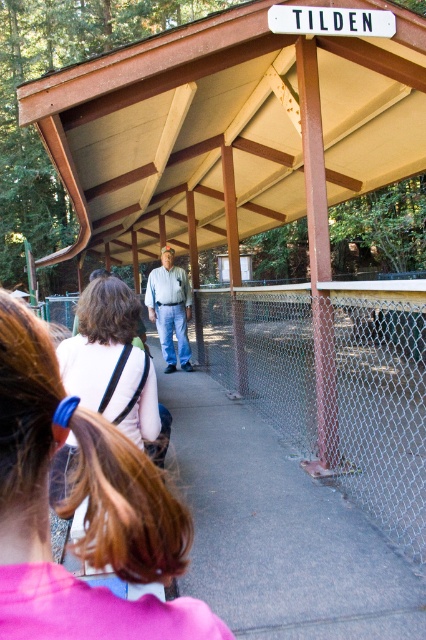
Question: Is light brown hair at center smaller than light blue jeans at center?

Choices:
 (A) no
 (B) yes

Answer: (B)

Question: Does wooden roof at center come in front of metal chain-link fence at center?

Choices:
 (A) no
 (B) yes

Answer: (B)

Question: Is metal chain-link fence at center above light brown hair at center?

Choices:
 (A) yes
 (B) no

Answer: (A)

Question: Which is nearer to the light blue jeans at center?

Choices:
 (A) metal chain-link fence at center
 (B) wooden roof at center
 (C) light brown hair at center

Answer: (B)

Question: Which object is the closest to the metal chain-link fence at center?

Choices:
 (A) wooden roof at center
 (B) light blue jeans at center
 (C) light brown hair at center

Answer: (B)

Question: Which point is farther to the camera?

Choices:
 (A) (46, 515)
 (B) (85, 84)
 (C) (170, 360)

Answer: (C)